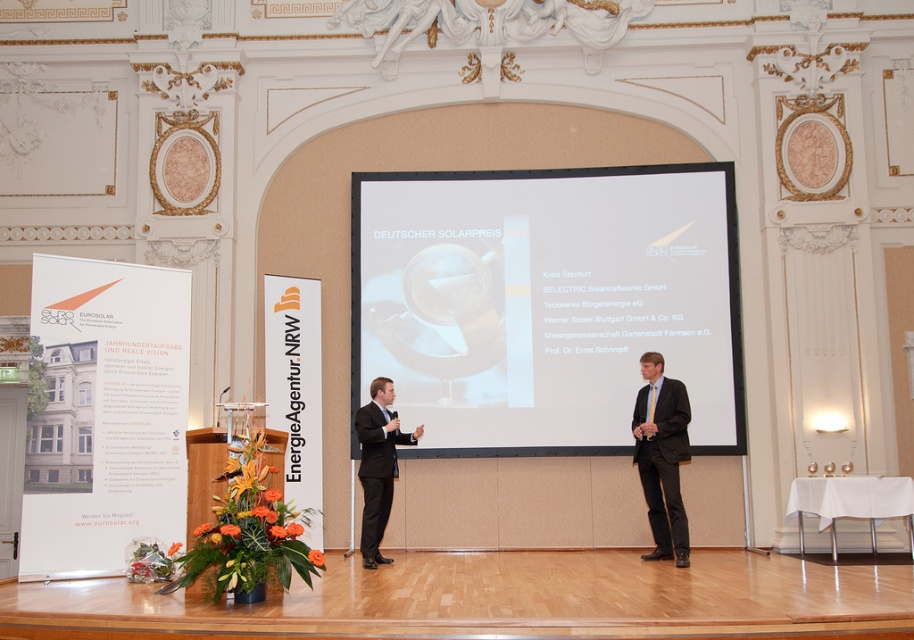
You are standing at the back of the hall and want to approach the dark suit at center to greet the person. If the hall is 30 feet long, will you be able to reach them before the end of the hall?

The dark suit at center is 27.85 feet away from the camera. Since the hall is 30 feet long, you can reach them before reaching the end of the hall as there is still 2.15 feet remaining between them and the end.

You are an event coordinator setting up for a presentation. You have a dark suit at center that needs to be placed next to the white glossy projection screen at center. Considering their sizes, which one should be placed on the side with more space?

A: The white glossy projection screen at center is wider than the dark suit at center, so it should be placed on the side with more space to accommodate its larger width.

You are an event organizer who needs to ensure that the white glossy projection screen at center and the matte black suit at center are visible to all attendees. Considering their sizes, which object will appear larger to the audience?

The white glossy projection screen at center appears larger than the matte black suit at center because its width is greater, making it more prominent to the audience.